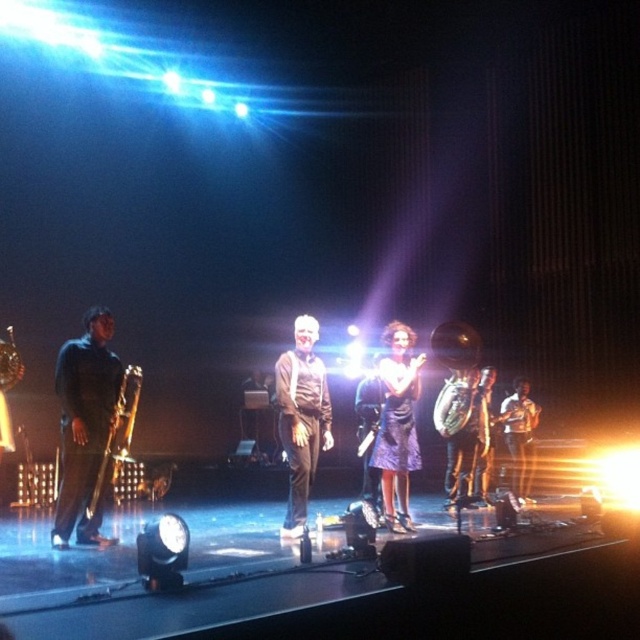
Question: Considering the real-world distances, which object is closest to the matte black trombone at left?

Choices:
 (A) shiny gold tuba at center
 (B) shiny purple dress at center
 (C) gold metallic tuba at center
 (D) gold metallic tuba at right

Answer: (B)

Question: Observing the image, what is the correct spatial positioning of matte black saxophone at left in reference to satin purple dress at center?

Choices:
 (A) right
 (B) left

Answer: (B)

Question: Does matte black trombone at left have a lesser width compared to satin purple dress at center?

Choices:
 (A) yes
 (B) no

Answer: (B)

Question: Which of these objects is positioned farthest from the shiny purple dress at center?

Choices:
 (A) matte black saxophone at left
 (B) dark gray suit at center
 (C) satin purple dress at center

Answer: (A)

Question: Is dark gray suit at center wider than gold metallic tuba at right?

Choices:
 (A) yes
 (B) no

Answer: (B)

Question: Among these objects, which one is nearest to the camera?

Choices:
 (A) matte black trombone at left
 (B) shiny gold tuba at center

Answer: (A)